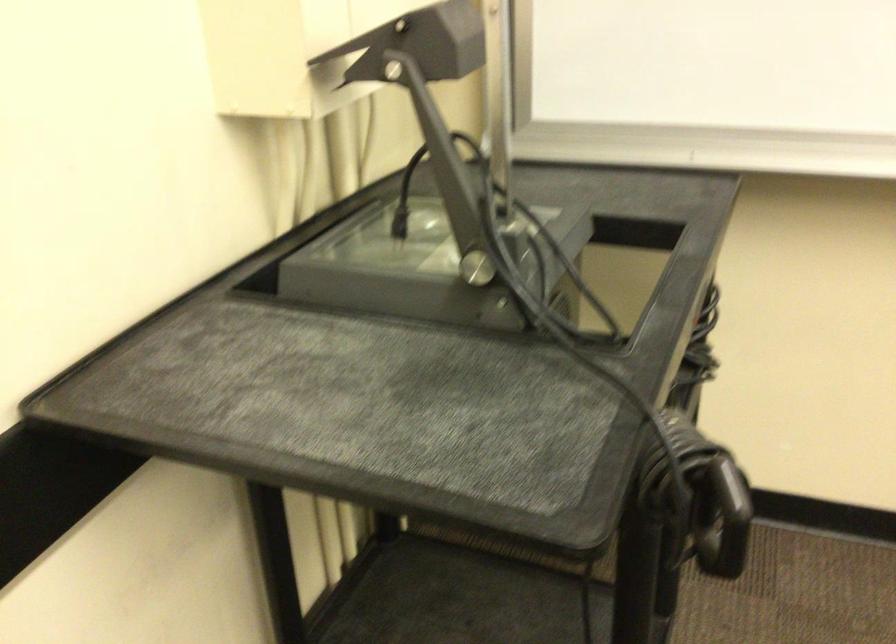
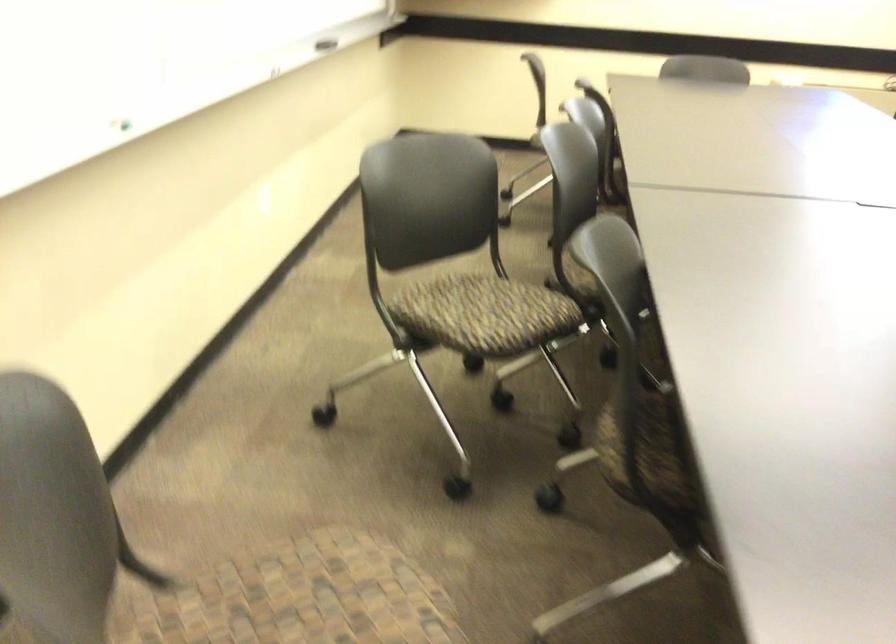
The first image is from the beginning of the video and the second image is from the end. How did the camera likely rotate when shooting the video?

The camera rotated toward right-down.